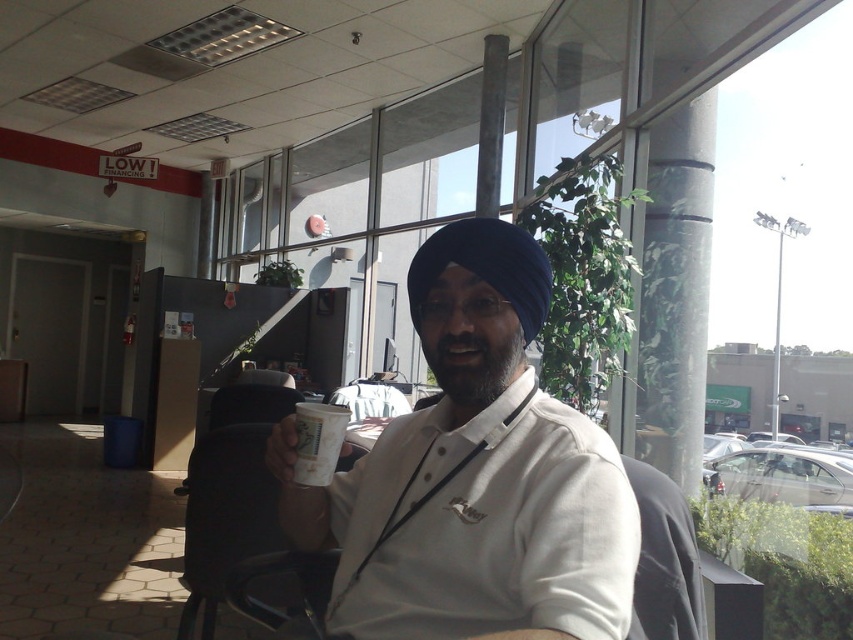
Is white matte shirt at center bigger than black plastic chair at center?

No, white matte shirt at center is not bigger than black plastic chair at center.

Where is `white matte shirt at center`? The width and height of the screenshot is (853, 640). white matte shirt at center is located at coordinates (474, 476).

This screenshot has width=853, height=640. What are the coordinates of `white matte shirt at center` in the screenshot? It's located at (474, 476).

Can you confirm if black plastic chair at center is positioned above white paper cup at center?

No, black plastic chair at center is not above white paper cup at center.

Can you confirm if black plastic chair at center is bigger than white paper cup at center?

Yes.

The height and width of the screenshot is (640, 853). I want to click on black plastic chair at center, so click(238, 531).

Is white matte shirt at center closer to the viewer compared to white paper cup at center?

Yes, it is.

Is point (515, 515) positioned behind point (323, 426)?

No, it is in front of (323, 426).

Who is more forward, (437,324) or (308,477)?

Point (437,324) is more forward.

Identify the location of white matte shirt at center. (474, 476).